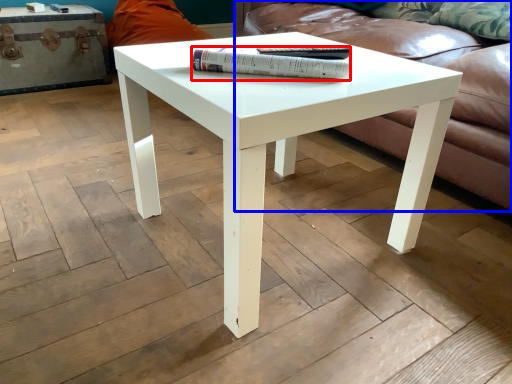
Question: Which point is closer to the camera, paperback book (highlighted by a red box) or studio couch (highlighted by a blue box)?

Choices:
 (A) paperback book
 (B) studio couch

Answer: (A)